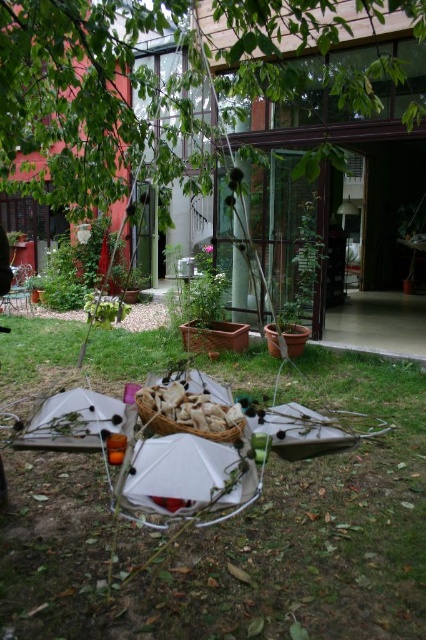
In the garden scene, you see green grass at center and a green leafy tree at upper center. Which object is positioned to the right of the other?

The green grass at center is to the right of the green leafy tree at upper center.

You are standing at the origin point in the garden. You see two points marked as point 1 at coordinates point (69, 358) and point 2 at coordinates point (36, 134). If you want to walk to point 1, which direction should you move relative to point 2?

Since point (69, 358) is behind point (36, 134), you should move in the direction away from point 2 to reach point 1.

You are a gardener who wants to place a new decoration in the garden. The decoration is the size of the white paper bag at center. Where should you place it so that it is not overshadowed by the green leafy tree at upper center?

The green leafy tree at upper center is bigger than the white paper bag at center, so placing the decoration near the base of the green leafy tree at upper center would ensure it remains visible and not overshadowed by the larger tree.